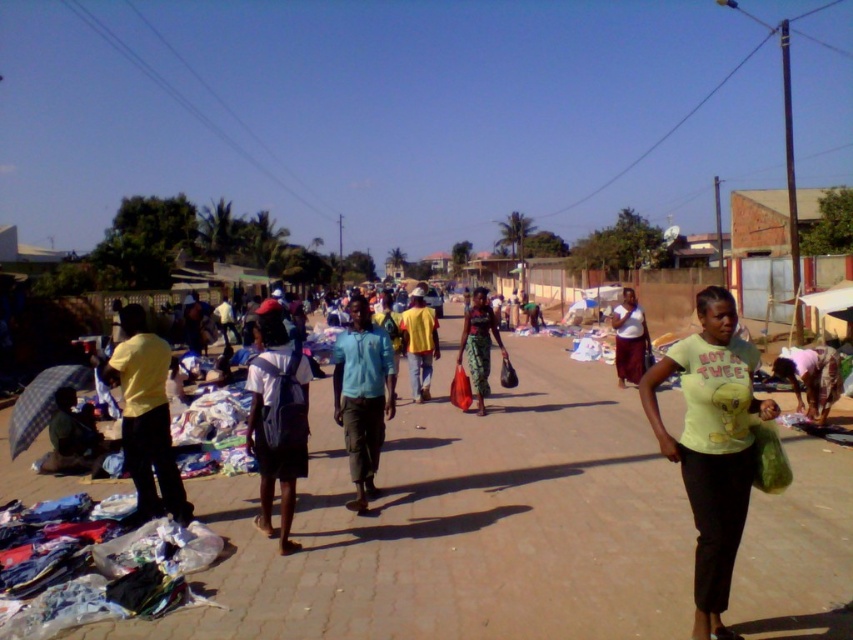
Question: Observing the image, what is the correct spatial positioning of yellow matte t-shirt at center-right in reference to matte green skirt at center?

Choices:
 (A) left
 (B) right

Answer: (B)

Question: Which point is closer to the camera taking this photo?

Choices:
 (A) (345, 429)
 (B) (773, 362)
 (C) (491, 342)

Answer: (A)

Question: Among these objects, which one is farthest from the camera?

Choices:
 (A) matte green skirt at center
 (B) yellow matte t-shirt at center-right
 (C) light pink fabric at lower right

Answer: (A)

Question: Which of these objects is positioned closest to the white matte backpack at center?

Choices:
 (A) matte white shirt at center
 (B) matte green skirt at center

Answer: (B)

Question: Is white matte backpack at center wider than matte white shirt at center?

Choices:
 (A) no
 (B) yes

Answer: (B)

Question: Is white matte backpack at center to the right of matte green skirt at center from the viewer's perspective?

Choices:
 (A) yes
 (B) no

Answer: (B)